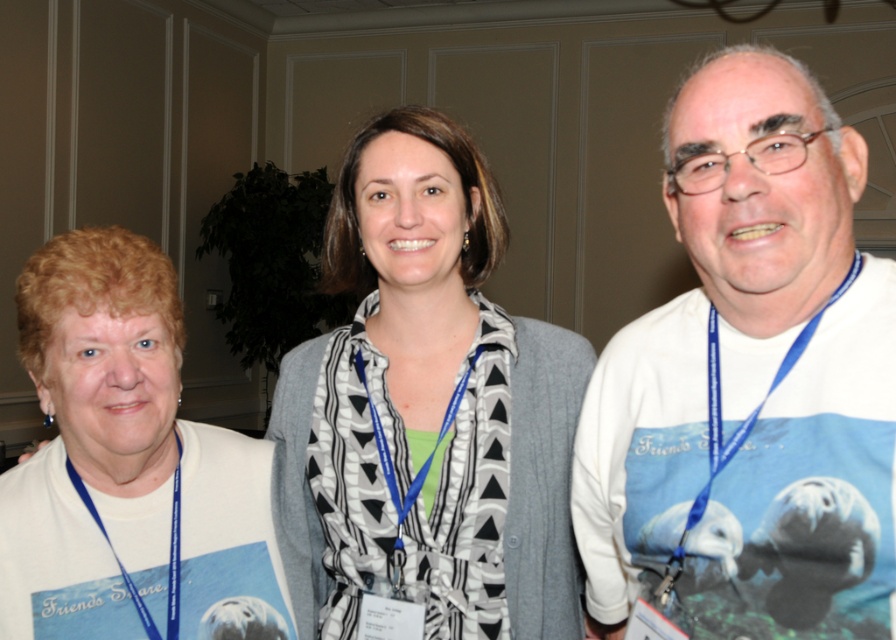
Question: Is white cotton shirt at center above blue fabric lanyard at right?

Choices:
 (A) no
 (B) yes

Answer: (B)

Question: Which object is the closest to the white matte sweatshirt at center?

Choices:
 (A) blue fabric lanyard at left
 (B) blue fabric lanyard at right
 (C) white cotton shirt at center

Answer: (A)

Question: Which object is positioned closest to the blue fabric lanyard at right?

Choices:
 (A) white cotton shirt at center
 (B) white matte shirt at center
 (C) white matte sweatshirt at center
 (D) blue fabric lanyard at left

Answer: (A)

Question: Can you confirm if white matte sweatshirt at center is bigger than blue fabric lanyard at left?

Choices:
 (A) no
 (B) yes

Answer: (B)

Question: Can you confirm if white matte shirt at center is positioned to the left of white matte sweatshirt at center?

Choices:
 (A) no
 (B) yes

Answer: (A)

Question: Which object is the farthest from the blue fabric lanyard at left?

Choices:
 (A) white cotton shirt at center
 (B) white matte sweatshirt at center
 (C) white matte shirt at center
 (D) blue fabric lanyard at right

Answer: (A)